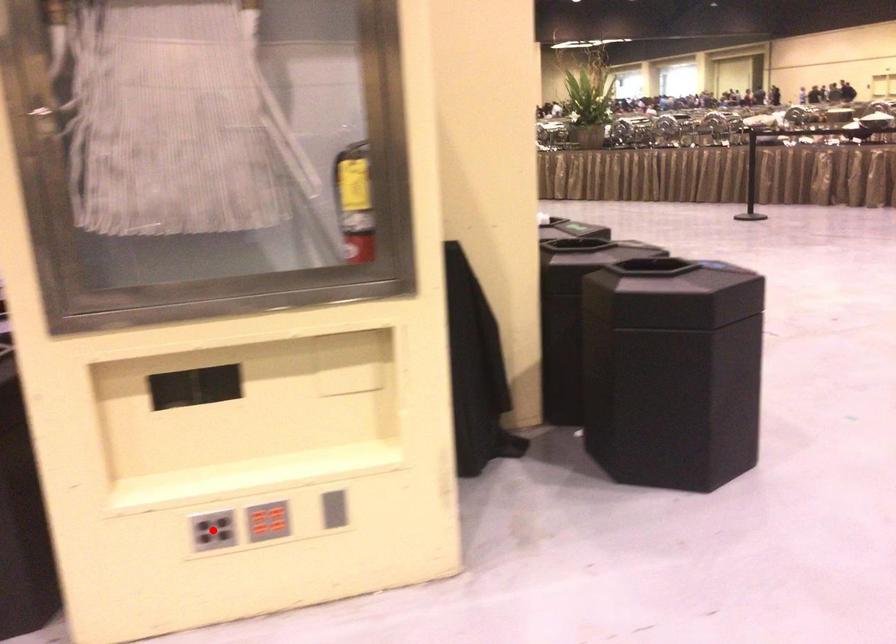
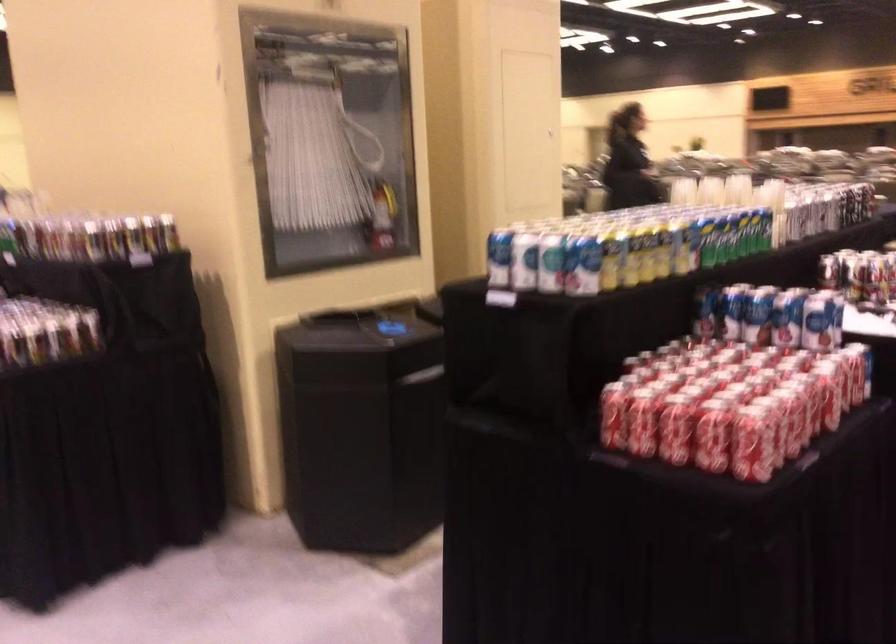
Question: I am providing you with two images of the same scene from different viewpoints. A red point is marked on the first image. Is the red point's position out of view in image 2?

Choices:
 (A) Yes
 (B) No

Answer: (A)